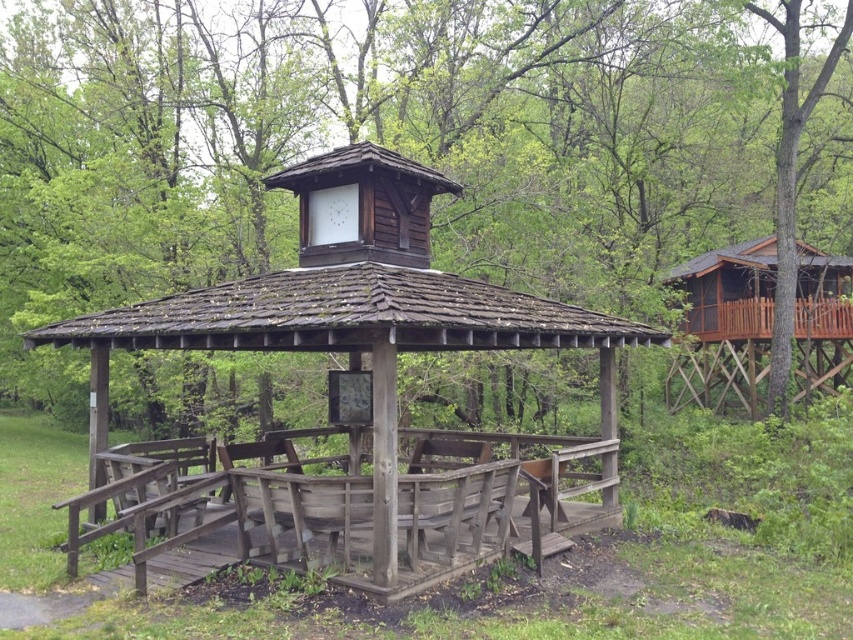
Question: Does brown wooden gazebo at center appear under wooden cabin at right?

Choices:
 (A) no
 (B) yes

Answer: (A)

Question: Which of the following is the closest to the observer?

Choices:
 (A) (494, 285)
 (B) (599, 3)

Answer: (A)

Question: Is brown wooden gazebo at center wider than weathered wood gazebo at center?

Choices:
 (A) yes
 (B) no

Answer: (A)

Question: Among these points, which one is nearest to the camera?

Choices:
 (A) (107, 202)
 (B) (532, 515)
 (C) (819, 253)

Answer: (B)

Question: Among these objects, which one is farthest from the camera?

Choices:
 (A) wooden cabin at right
 (B) brown wooden gazebo at center
 (C) weathered wood gazebo at center

Answer: (A)

Question: Is the position of brown wooden gazebo at center more distant than that of wooden cabin at right?

Choices:
 (A) yes
 (B) no

Answer: (B)